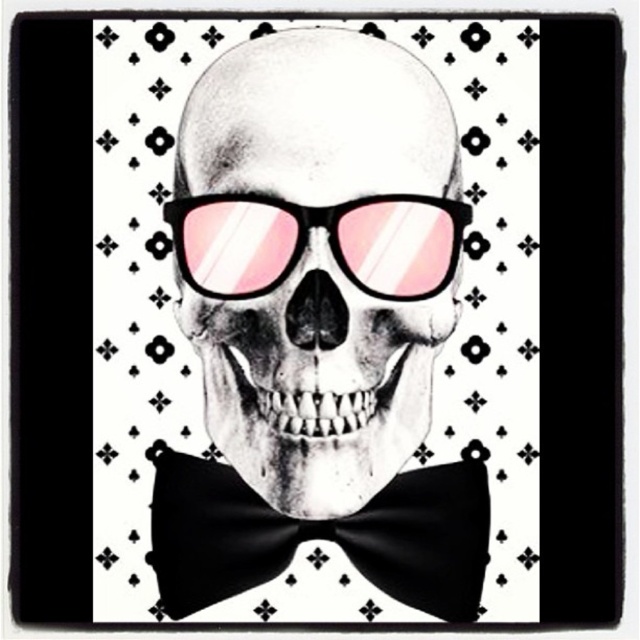
You are an artist trying to draw the skull from the image. You want to place the black satin bow tie at center correctly. According to the coordinates given, where should you position it relative to the skull?

The black satin bow tie at center should be positioned at point 0.839 on the x axis and 0.500 on the y axis relative to the skull.

You are a fashion designer creating a new accessory line. You want to place a black satin bow tie at center on a model wearing a black matte skull at center. Based on the image, will the bow tie be visible when placed on the skull?

The black matte skull at center is in front of the black satin bow tie at center, so the bow tie will not be visible as it is obscured by the skull.

You are designing a poster for a gothic fashion show and need to ensure the black matte skull at center and black satin bow tie at center are proportionally accurate. Given that the skull is larger, which object should you scale down to maintain the aesthetic balance?

The black satin bow tie at center should be scaled down since the black matte skull at center is larger in size, maintaining the proportional relationship between the two elements.